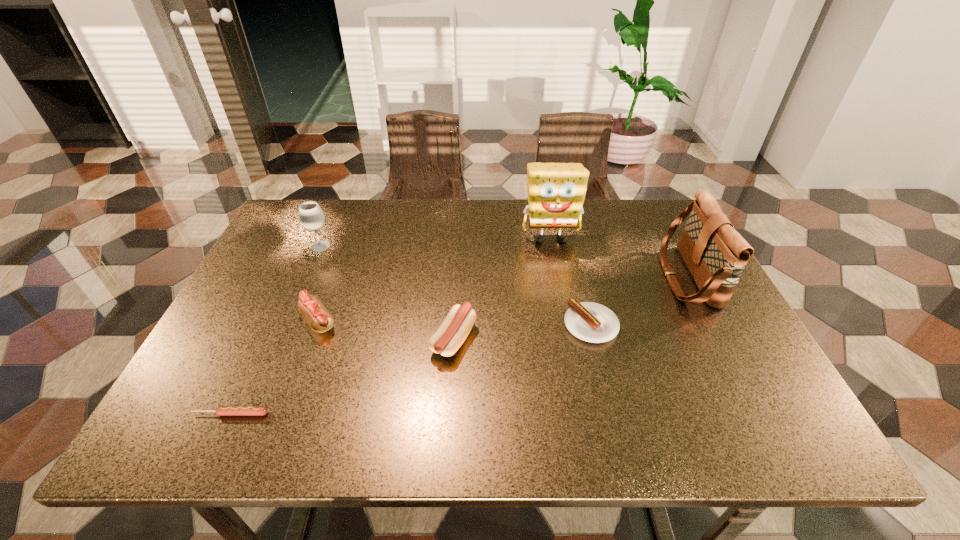
Choose which object is the second nearest neighbor to the second shortest sausage. Please provide its 2D coordinates. Your answer should be formatted as a tuple, i.e. [(x, y)], where the tuple contains the x and y coordinates of a point satisfying the conditions above.

[(449, 337)]

In order to click on sausage that is the second nearest to the wineglass in this screenshot , I will do `click(449, 337)`.

Choose which sausage is the second nearest neighbor to the sponge. Please provide its 2D coordinates. Your answer should be formatted as a tuple, i.e. [(x, y)], where the tuple contains the x and y coordinates of a point satisfying the conditions above.

[(449, 337)]